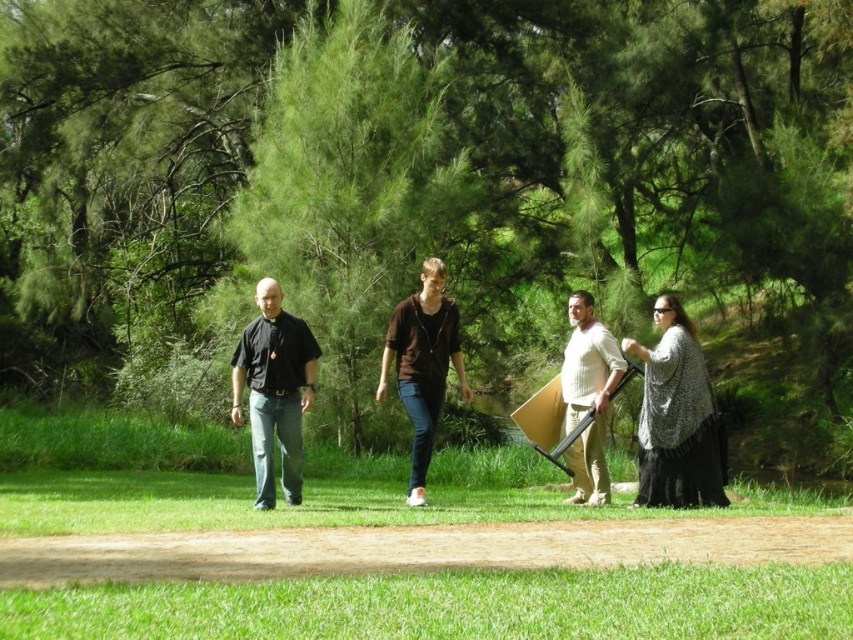
Can you confirm if patterned knit sweater at right is positioned above knit sweater at center?

Yes.

Between patterned knit sweater at right and knit sweater at center, which one has more height?

knit sweater at center is taller.

This screenshot has height=640, width=853. What do you see at coordinates (676, 417) in the screenshot?
I see `patterned knit sweater at right` at bounding box center [676, 417].

You are a GUI agent. You are given a task and a screenshot of the screen. Output one action in this format:
    pyautogui.click(x=<x>, y=<y>)
    Task: Click on the patterned knit sweater at right
    The image size is (853, 640).
    Given the screenshot: What is the action you would take?
    pyautogui.click(x=676, y=417)

Can you confirm if green grass at lower center is positioned above black matte shirt at left?

No, green grass at lower center is not above black matte shirt at left.

Between green grass at lower center and black matte shirt at left, which one appears on the right side from the viewer's perspective?

green grass at lower center

Locate an element on the screen. This screenshot has height=640, width=853. green grass at lower center is located at coordinates (456, 605).

Locate an element on the screen. green grass at lower center is located at coordinates (456, 605).

Between brown cotton hoodie at center and knit sweater at center, which one appears on the left side from the viewer's perspective?

Positioned to the left is brown cotton hoodie at center.

Is point (432, 292) less distant than point (572, 445)?

Yes.

Image resolution: width=853 pixels, height=640 pixels. Find the location of `brown cotton hoodie at center`. brown cotton hoodie at center is located at coordinates (422, 364).